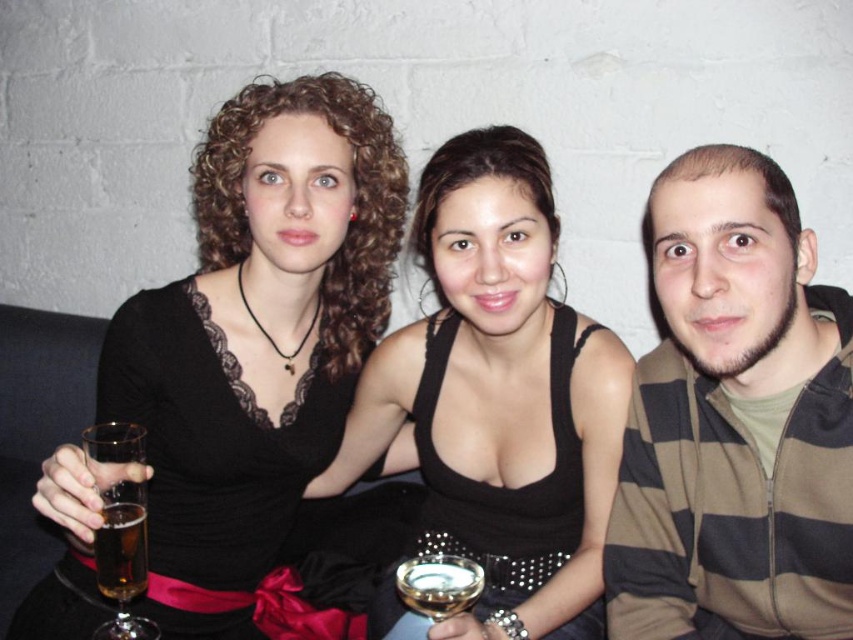
Question: Which object appears farthest from the camera in this image?

Choices:
 (A) gold metallic wine glass at center
 (B) translucent glass at left
 (C) translucent glass beer at lower left

Answer: (A)

Question: Can you confirm if translucent glass at left is thinner than translucent glass beer at lower left?

Choices:
 (A) no
 (B) yes

Answer: (A)

Question: Which object is the farthest from the black lace dress at center?

Choices:
 (A) translucent glass at left
 (B) translucent glass beer at lower left

Answer: (B)

Question: Based on their relative distances, which object is farther from the striped hoodie at right?

Choices:
 (A) black lace dress at center
 (B) translucent glass beer at lower left

Answer: (B)

Question: Does striped hoodie at right come in front of translucent glass at left?

Choices:
 (A) yes
 (B) no

Answer: (B)

Question: Is black satin dress at center closer to camera compared to translucent glass at left?

Choices:
 (A) no
 (B) yes

Answer: (A)